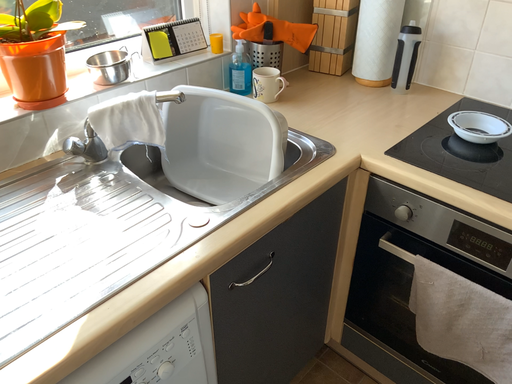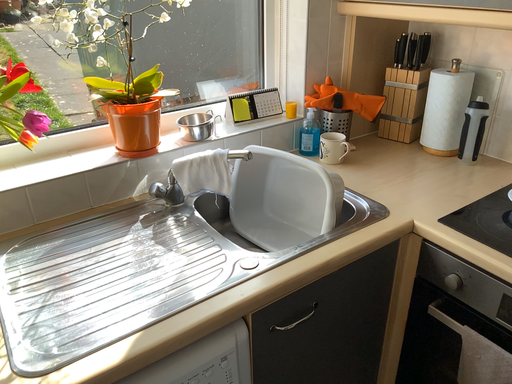
Question: Which way did the camera rotate in the video?

Choices:
 (A) rotated upward
 (B) rotated downward

Answer: (A)